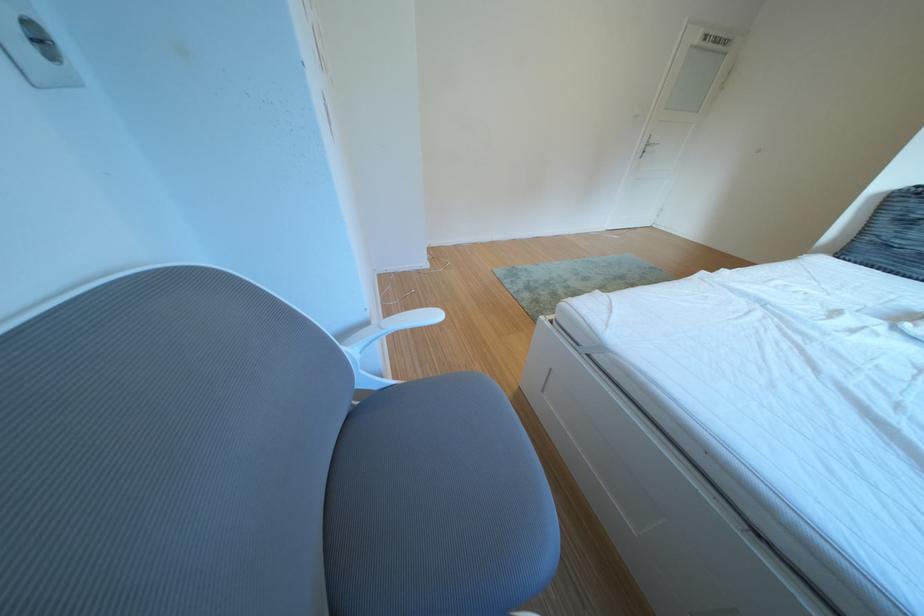
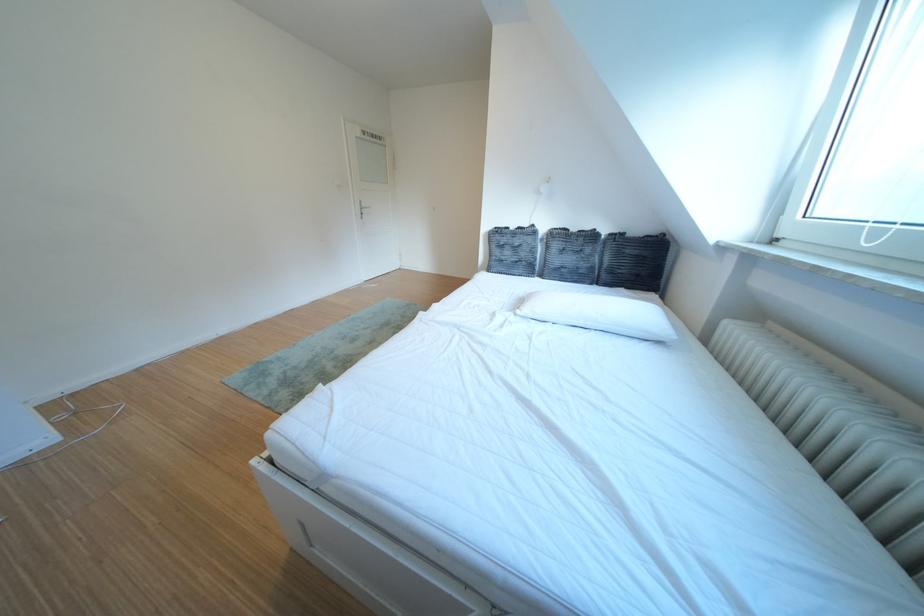
Question: The images are taken continuously from a first-person perspective. In which direction is your viewpoint rotating?

Choices:
 (A) Left
 (B) Right
 (C) Up
 (D) Down

Answer: (B)